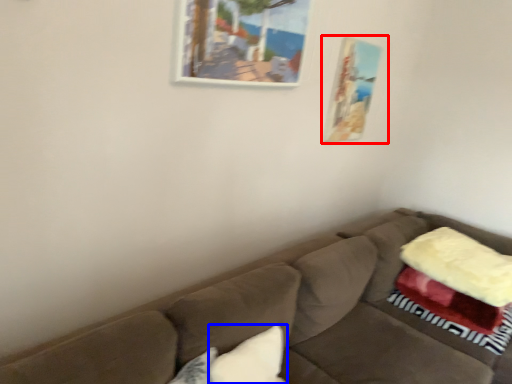
Question: Among these objects, which one is farthest to the camera, picture frame (highlighted by a red box) or pillow (highlighted by a blue box)?

Choices:
 (A) picture frame
 (B) pillow

Answer: (A)